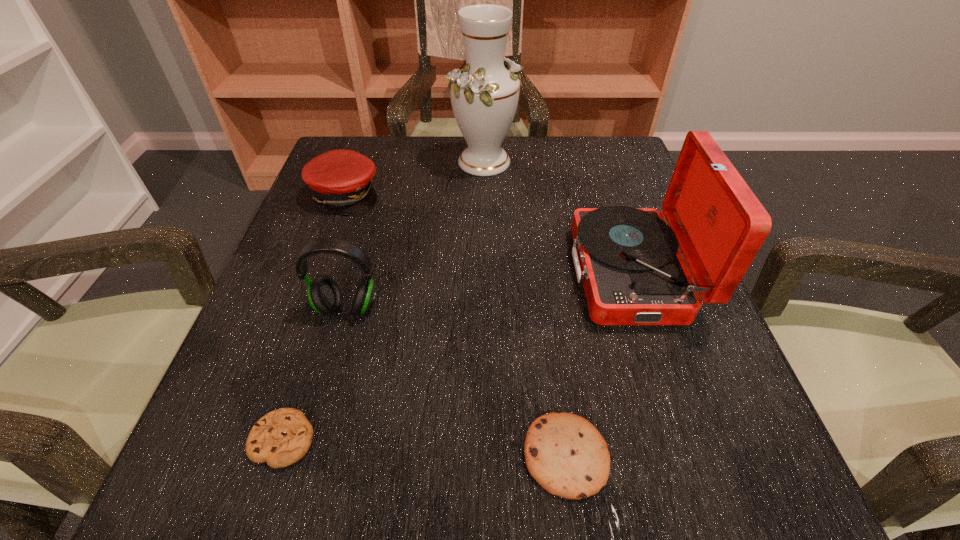
Locate an element on the screen. The height and width of the screenshot is (540, 960). cap situated at the left edge is located at coordinates (341, 180).

Find the location of `cookie present at the left edge`. cookie present at the left edge is located at coordinates (282, 437).

You are a GUI agent. You are given a task and a screenshot of the screen. Output one action in this format:
    pyautogui.click(x=<x>, y=<y>)
    Task: Click on the object situated at the right edge
    
    Given the screenshot: What is the action you would take?
    [x=628, y=260]

Locate an element on the screen. This screenshot has height=540, width=960. object that is at the far left corner is located at coordinates (341, 180).

I want to click on object that is at the near left corner, so click(x=282, y=437).

You are a GUI agent. You are given a task and a screenshot of the screen. Output one action in this format:
    pyautogui.click(x=<x>, y=<y>)
    Task: Click on the free spot at the far edge of the desktop
    
    Given the screenshot: What is the action you would take?
    pyautogui.click(x=415, y=182)

Identify the location of free space at the near edge. The width and height of the screenshot is (960, 540). (373, 462).

At what (x,y) coordinates should I click in order to perform the action: click on blank space at the left edge. Please return your answer as a coordinate pair (x, y). Looking at the image, I should click on (335, 270).

What are the coordinates of `free space at the right edge of the desktop` in the screenshot? It's located at (694, 364).

The image size is (960, 540). What are the coordinates of `vacant space at the far right corner of the desktop` in the screenshot? It's located at (612, 151).